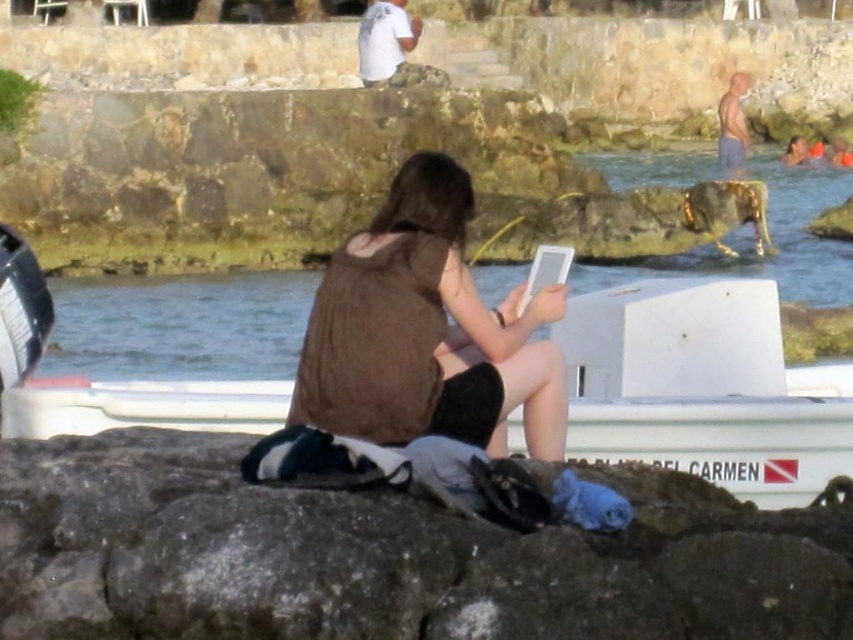
Question: Which of the following is the closest to the observer?

Choices:
 (A) skinny bald man at upper right
 (B) white cotton shirt at upper center
 (C) white matte boat at center
 (D) brown matte tank top at center

Answer: (D)

Question: Does brown matte tank top at center appear under white cotton shirt at upper center?

Choices:
 (A) yes
 (B) no

Answer: (A)

Question: Is brown matte tank top at center to the right of skinny bald man at upper right from the viewer's perspective?

Choices:
 (A) yes
 (B) no

Answer: (B)

Question: Can you confirm if white matte boat at center is wider than white cotton shirt at upper center?

Choices:
 (A) no
 (B) yes

Answer: (B)

Question: Based on their relative distances, which object is nearer to the gold metallic cow at upper center?

Choices:
 (A) brown matte tank top at center
 (B) smooth gray rock at center

Answer: (B)

Question: Which object is positioned farthest from the white cotton shirt at upper center?

Choices:
 (A) white matte boat at center
 (B) gold metallic cow at upper center
 (C) smooth gray rock at center
 (D) brown matte tank top at center

Answer: (C)